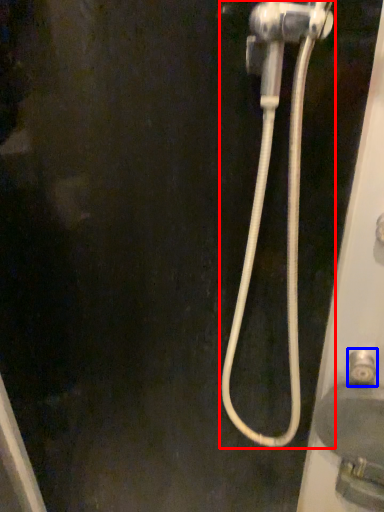
Question: Among these objects, which one is farthest to the camera, plumbing fixture (highlighted by a red box) or faucet (highlighted by a blue box)?

Choices:
 (A) plumbing fixture
 (B) faucet

Answer: (B)